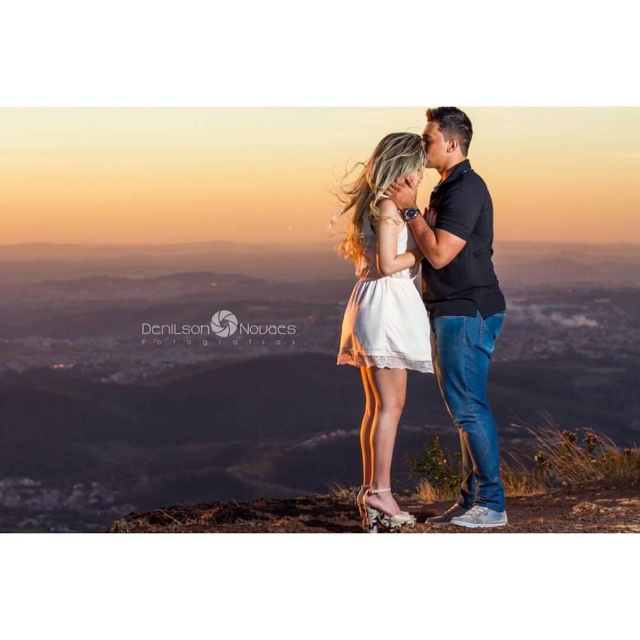
Does point (474, 186) lie behind point (397, 362)?

Yes, it is.

Who is shorter, black cotton shirt at center or white lace dress at center?

white lace dress at center is shorter.

Locate an element on the screen. This screenshot has height=640, width=640. black cotton shirt at center is located at coordinates (460, 305).